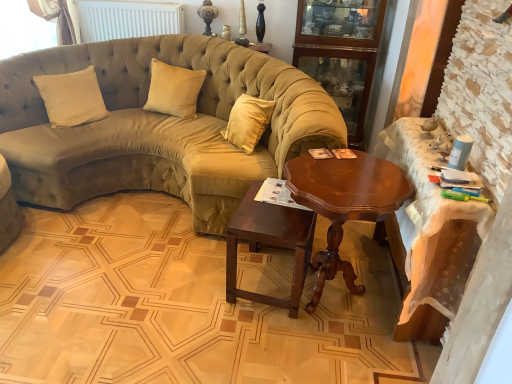
At what (x,y) coordinates should I click in order to perform the action: click on free space above wooden table at right, arranged as the 2th table when viewed from the left (from a real-world perspective). Please return your answer as a coordinate pair (x, y). Looking at the image, I should click on (441, 157).